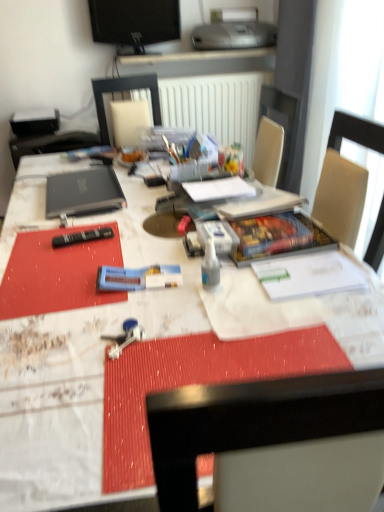
Find the location of a particular element. The image size is (384, 512). free space that is in between blue plastic toothpaste tube at center and transparent plastic bottle at center is located at coordinates (174, 286).